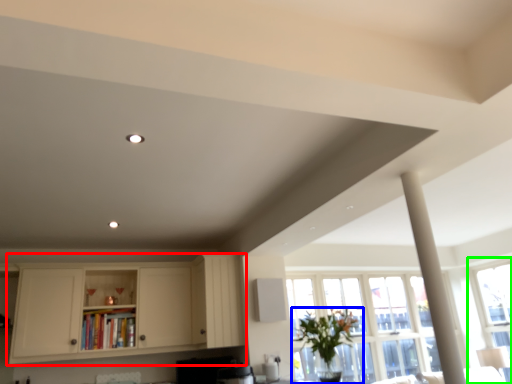
Question: Based on their relative distances, which object is nearer to cabinetry (highlighted by a red box)? Choose from houseplant (highlighted by a blue box) and window (highlighted by a green box).

Choices:
 (A) houseplant
 (B) window

Answer: (A)